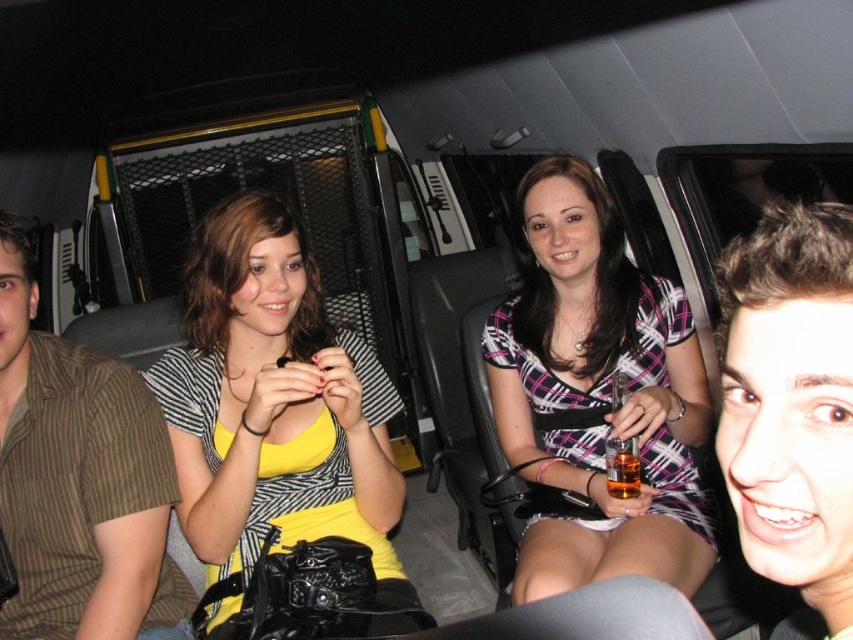
Does plaid fabric dress at center have a smaller size compared to brown striped shirt at left?

Actually, plaid fabric dress at center might be larger than brown striped shirt at left.

Who is positioned more to the left, plaid fabric dress at center or brown striped shirt at left?

From the viewer's perspective, brown striped shirt at left appears more on the left side.

Between point (582, 467) and point (26, 596), which one is positioned behind?

Positioned behind is point (582, 467).

The image size is (853, 640). I want to click on plaid fabric dress at center, so click(596, 394).

Which is behind, point (212, 467) or point (74, 564)?

Positioned behind is point (212, 467).

Identify the location of yellow fabric dress at center. (276, 404).

Is plaid fabric dress at center below translucent amber liquid at lower right?

Actually, plaid fabric dress at center is above translucent amber liquid at lower right.

Between plaid fabric dress at center and translucent amber liquid at lower right, which one has less height?

Standing shorter between the two is translucent amber liquid at lower right.

Is point (527, 320) farther from viewer compared to point (637, 483)?

Yes, point (527, 320) is farther from viewer.

Where is `plaid fabric dress at center`? plaid fabric dress at center is located at coordinates (596, 394).